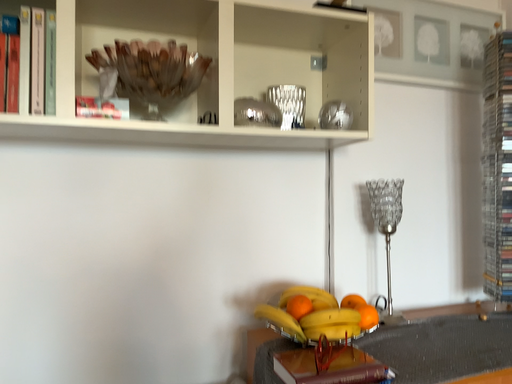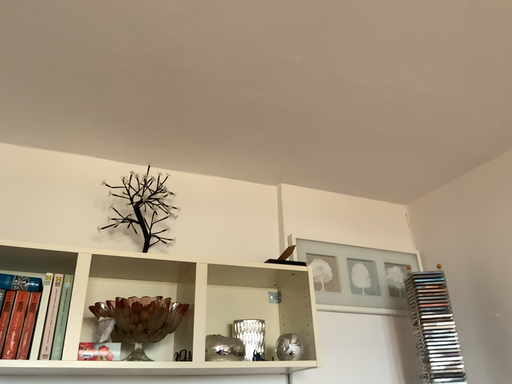
Question: How did the camera likely rotate when shooting the video?

Choices:
 (A) rotated upward
 (B) rotated downward

Answer: (A)